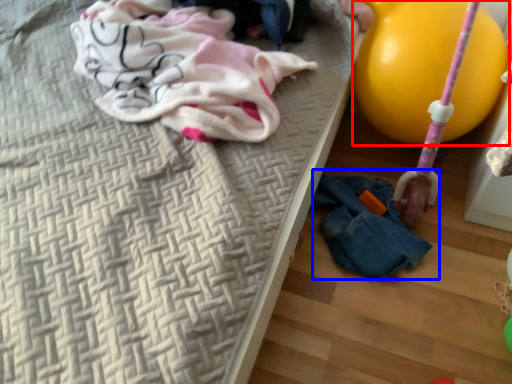
Question: Which point is further to the camera, balloon (highlighted by a red box) or woman (highlighted by a blue box)?

Choices:
 (A) balloon
 (B) woman

Answer: (B)